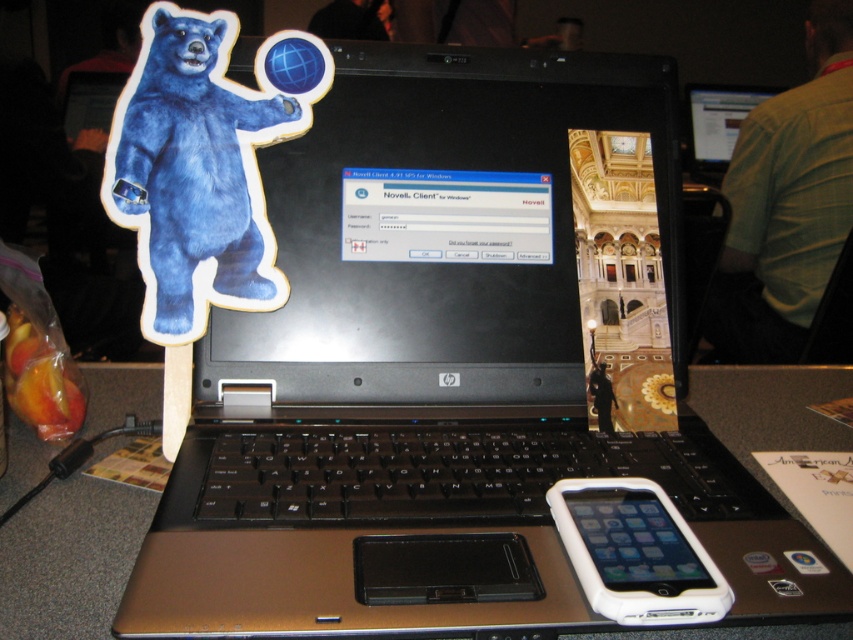
Locate an element on the screen. The image size is (853, 640). fuzzy blue bear at left is located at coordinates pyautogui.click(x=198, y=170).

Is fuzzy blue bear at left shorter than metallic gray table at center?

No.

Which is in front, point (242, 232) or point (84, 636)?

Point (84, 636) is more forward.

At what (x,y) coordinates should I click in order to perform the action: click on fuzzy blue bear at left. Please return your answer as a coordinate pair (x, y). Image resolution: width=853 pixels, height=640 pixels. Looking at the image, I should click on (198, 170).

Based on the photo, measure the distance between metallic gray table at center and white plastic ipod at center.

metallic gray table at center is 6.19 inches from white plastic ipod at center.

Does metallic gray table at center have a greater width compared to white plastic ipod at center?

Indeed, metallic gray table at center has a greater width compared to white plastic ipod at center.

Locate an element on the screen. Image resolution: width=853 pixels, height=640 pixels. metallic gray table at center is located at coordinates (68, 557).

Find the location of a particular element. metallic gray table at center is located at coordinates (68, 557).

Who is shorter, fuzzy blue bear at left or white plastic ipod at center?

white plastic ipod at center is shorter.

In the scene shown: Who is taller, fuzzy blue bear at left or white plastic ipod at center?

Standing taller between the two is fuzzy blue bear at left.

I want to click on fuzzy blue bear at left, so click(198, 170).